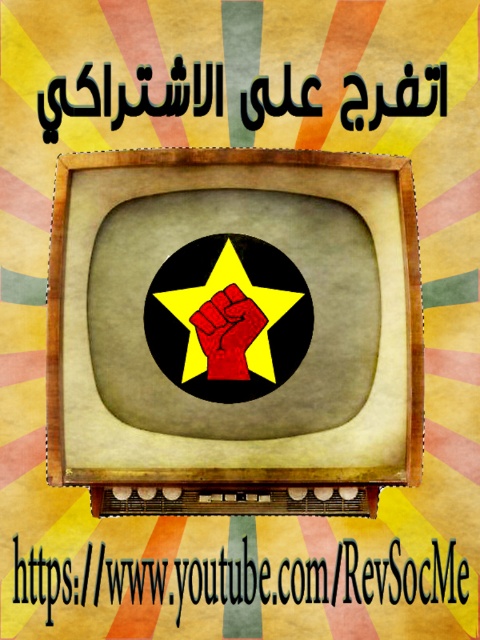
Question: Is the position of yellow matte star at center less distant than that of red matte/felt hand at center?

Choices:
 (A) no
 (B) yes

Answer: (B)

Question: Among these objects, which one is nearest to the camera?

Choices:
 (A) yellow matte star at center
 (B) red matte/felt hand at center

Answer: (A)

Question: Which point appears farthest from the camera in this image?

Choices:
 (A) (260, 360)
 (B) (196, 333)

Answer: (B)

Question: Where is yellow matte star at center located in relation to red matte/felt hand at center in the image?

Choices:
 (A) below
 (B) above

Answer: (B)

Question: Which object appears closest to the camera in this image?

Choices:
 (A) red matte/felt hand at center
 (B) yellow matte star at center

Answer: (B)

Question: Can you confirm if yellow matte star at center is wider than red matte/felt hand at center?

Choices:
 (A) yes
 (B) no

Answer: (A)